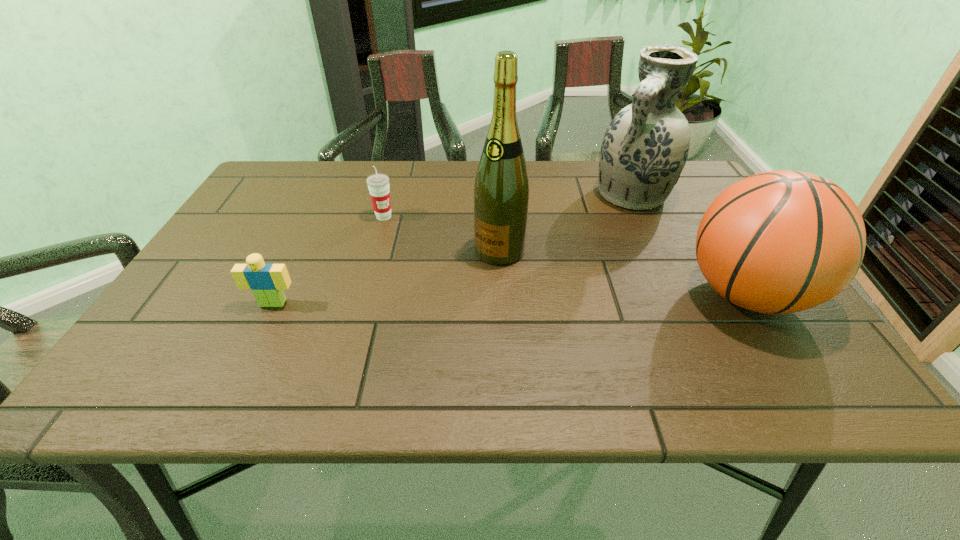
At what (x,y) coordinates should I click in order to perform the action: click on free space located on the side of the fourth object from right to left with the logo. Please return your answer as a coordinate pair (x, y). Looking at the image, I should click on (398, 231).

Where is `free location located 0.140m on the side of the fourth object from right to left with the logo`? free location located 0.140m on the side of the fourth object from right to left with the logo is located at coordinates (417, 248).

You are a GUI agent. You are given a task and a screenshot of the screen. Output one action in this format:
    pyautogui.click(x=<x>, y=<y>)
    Task: Click on the free space located 0.070m on the front-facing side of the wine bottle
    This screenshot has height=540, width=960.
    Given the screenshot: What is the action you would take?
    pyautogui.click(x=469, y=281)

Locate an element on the screen. The image size is (960, 540). free space located on the front-facing side of the wine bottle is located at coordinates (441, 312).

Identify the location of free location located 0.150m on the front-facing side of the wine bottle. (449, 303).

Locate an element on the screen. The height and width of the screenshot is (540, 960). free point located 0.080m with the handle on the side of the vase is located at coordinates (609, 229).

At what (x,y) coordinates should I click in order to perform the action: click on vacant region located with the handle on the side of the vase. Please return your answer as a coordinate pair (x, y). The width and height of the screenshot is (960, 540). Looking at the image, I should click on (599, 243).

Identify the location of vacant point located with the handle on the side of the vase. coord(605,235).

I want to click on object that is positioned at the far edge, so click(x=645, y=147).

Find the location of a particular element. This screenshot has height=540, width=960. object at the near edge is located at coordinates (778, 242).